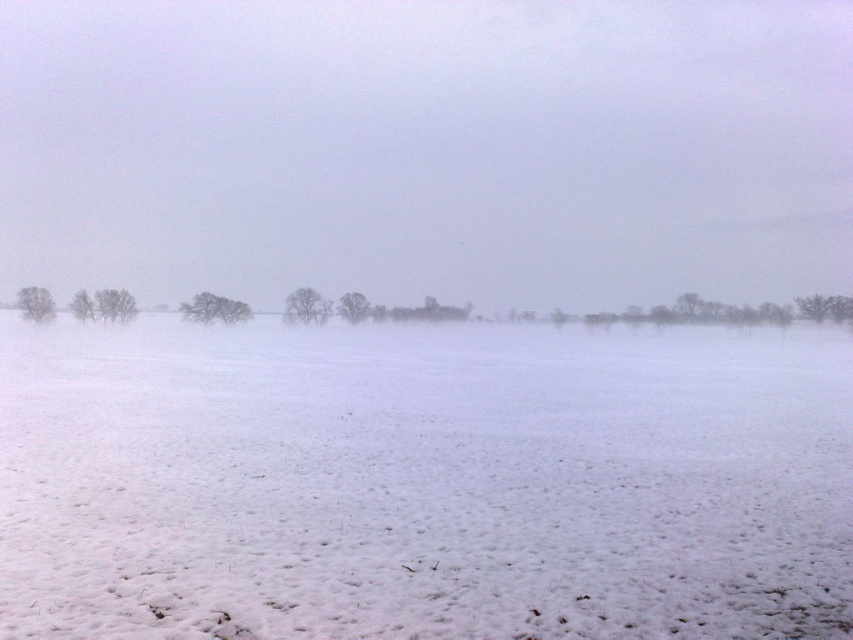
Question: Which of the following is the farthest from the observer?

Choices:
 (A) white fluffy snow at center
 (B) snowy bare tree at center

Answer: (B)

Question: Is the position of snowy bare tree at center less distant than that of bare branches at left?

Choices:
 (A) yes
 (B) no

Answer: (A)

Question: Can you confirm if bare branches at center is bigger than snowy bare tree at center?

Choices:
 (A) yes
 (B) no

Answer: (A)

Question: Which point is closer to the camera?

Choices:
 (A) (97, 304)
 (B) (207, 305)

Answer: (A)

Question: Which of the following is the closest to the observer?

Choices:
 (A) (45, 301)
 (B) (187, 314)

Answer: (A)

Question: Can you confirm if bare branches at center is thinner than snowy bare tree at center?

Choices:
 (A) no
 (B) yes

Answer: (A)